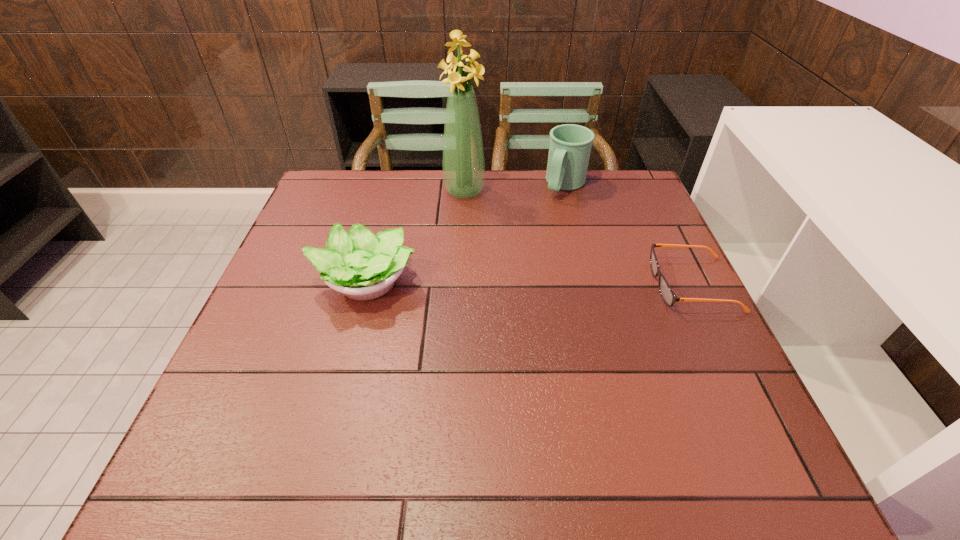
Identify the location of object located at the left edge. (362, 266).

Where is `object that is at the right edge`? The height and width of the screenshot is (540, 960). object that is at the right edge is located at coordinates (669, 297).

This screenshot has width=960, height=540. In the image, there is a desktop. What are the coordinates of `free space at the far edge` in the screenshot? It's located at (509, 175).

Identify the location of vacant space at the near edge. This screenshot has width=960, height=540. (663, 417).

Image resolution: width=960 pixels, height=540 pixels. In the image, there is a desktop. In order to click on vacant space at the left edge in this screenshot , I will do `click(338, 219)`.

Find the location of a particular element. The height and width of the screenshot is (540, 960). vacant space at the right edge of the desktop is located at coordinates (635, 317).

This screenshot has width=960, height=540. What are the coordinates of `vacant area at the far left corner` in the screenshot? It's located at (351, 180).

The width and height of the screenshot is (960, 540). I want to click on free space at the far right corner, so (621, 199).

Find the location of a particular element. free space between the third tallest object and the rightmost object is located at coordinates (529, 283).

In order to click on vacant space in between the rightmost object and the second object from left to right in this screenshot , I will do (x=579, y=238).